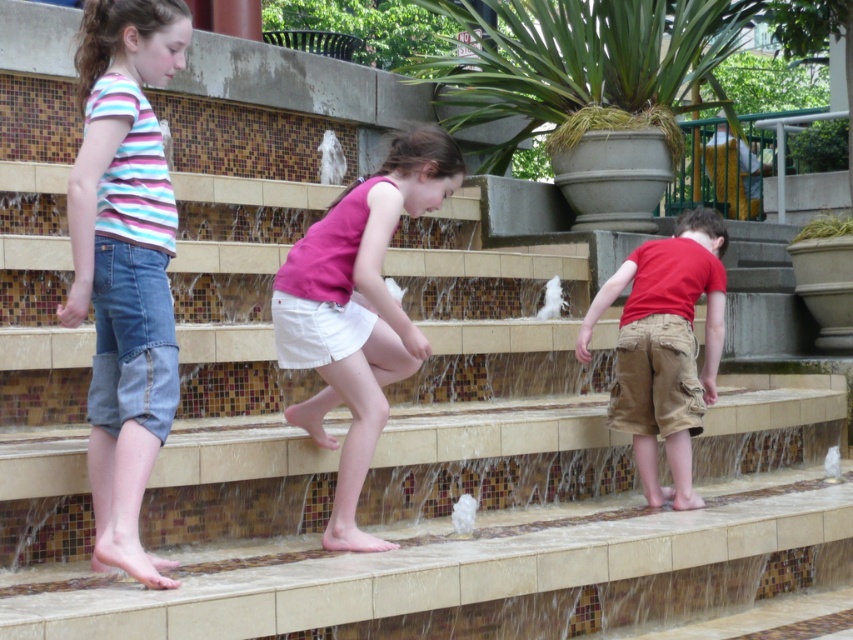
You are a photographer trying to capture a candid shot of the two children in the water feature. The pink fabric shorts at center and the red cotton shirt at lower right are your subjects. Based on their positions, which child is positioned to the left of the other?

The pink fabric shorts at center are to the left of the red cotton shirt at lower right, so the child wearing the pink fabric shorts at center is positioned to the left of the child in the red cotton shirt at lower right.

You are a photographer trying to capture a candid shot of the red cotton shirt at lower right without including the denim shorts at left in the frame. Based on their positions, is this possible?

The denim shorts at left is in front of red cotton shirt at lower right, so it may block the view. To avoid including the denim shorts at left, the photographer should adjust the angle to frame around the denim shorts at left or move to a position where the red cotton shirt at lower right is visible without obstruction from the denim shorts at left.